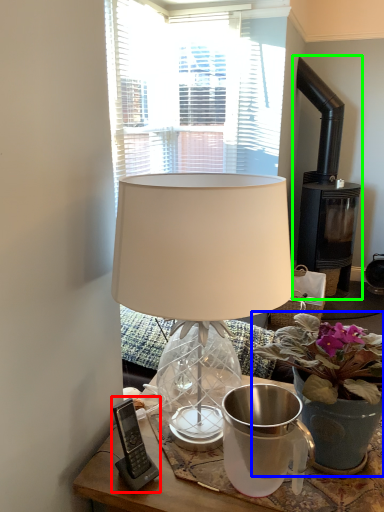
Question: Which is farther away from gadget (highlighted by a red box)? houseplant (highlighted by a blue box) or fireplace (highlighted by a green box)?

Choices:
 (A) houseplant
 (B) fireplace

Answer: (B)